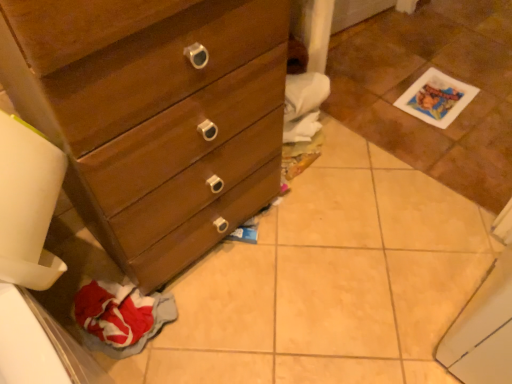
Locate an element on the screen. matte wood chest of drawers at lower left is located at coordinates (154, 115).

What do you see at coordinates (154, 115) in the screenshot? I see `matte wood chest of drawers at lower left` at bounding box center [154, 115].

The image size is (512, 384). Describe the element at coordinates (419, 76) in the screenshot. I see `white glossy tile at lower right` at that location.

What is the approximate width of white glossy tile at lower right?

white glossy tile at lower right is 78.42 centimeters in width.

Find the location of a particular element. Image resolution: width=512 pixels, height=384 pixels. white glossy tile at lower right is located at coordinates (419, 76).

This screenshot has width=512, height=384. I want to click on matte wood chest of drawers at lower left, so click(154, 115).

Is matte wood chest of drawers at lower left to the left of white glossy tile at lower right from the viewer's perspective?

Indeed, matte wood chest of drawers at lower left is positioned on the left side of white glossy tile at lower right.

Is matte wood chest of drawers at lower left in front of white glossy tile at lower right?

Yes, matte wood chest of drawers at lower left is closer to the viewer.

Considering the points (280, 44) and (357, 45), which point is behind, point (280, 44) or point (357, 45)?

Point (357, 45)

Looking at this image, from the image's perspective, would you say matte wood chest of drawers at lower left is shown under white glossy tile at lower right?

Indeed, from the image's perspective, matte wood chest of drawers at lower left is shown beneath white glossy tile at lower right.

From a real-world perspective, relative to white glossy tile at lower right, is matte wood chest of drawers at lower left vertically above or below?

In terms of real-world spatial position, matte wood chest of drawers at lower left is above white glossy tile at lower right.

Looking at their sizes, would you say matte wood chest of drawers at lower left is wider or thinner than white glossy tile at lower right?

matte wood chest of drawers at lower left is thinner than white glossy tile at lower right.

From their relative heights in the image, would you say matte wood chest of drawers at lower left is taller or shorter than white glossy tile at lower right?

Clearly, matte wood chest of drawers at lower left is taller compared to white glossy tile at lower right.

Between matte wood chest of drawers at lower left and white glossy tile at lower right, which one has larger size?

With larger size is matte wood chest of drawers at lower left.

Which is correct: matte wood chest of drawers at lower left is inside white glossy tile at lower right, or outside of it?

The correct answer is: outside.

Is there a large distance between matte wood chest of drawers at lower left and white glossy tile at lower right?

No, there isn't a large distance between matte wood chest of drawers at lower left and white glossy tile at lower right.

Does matte wood chest of drawers at lower left turn towards white glossy tile at lower right?

No.

How many degrees apart are the facing directions of matte wood chest of drawers at lower left and white glossy tile at lower right?

179 degrees separate the facing orientations of matte wood chest of drawers at lower left and white glossy tile at lower right.

Identify the location of tile on the right of matte wood chest of drawers at lower left. (419, 76).

Is white glossy tile at lower right to the right of matte wood chest of drawers at lower left from the viewer's perspective?

Yes.

Is white glossy tile at lower right positioned behind matte wood chest of drawers at lower left?

Yes, white glossy tile at lower right is further from the viewer.

Which is in front, point (492, 72) or point (136, 38)?

Point (136, 38)

From the image's perspective, which object appears higher, white glossy tile at lower right or matte wood chest of drawers at lower left?

white glossy tile at lower right is shown above in the image.

From a real-world perspective, which object stands above the other?

matte wood chest of drawers at lower left.

Which object is wider, white glossy tile at lower right or matte wood chest of drawers at lower left?

white glossy tile at lower right.

Is white glossy tile at lower right shorter than matte wood chest of drawers at lower left?

Correct, white glossy tile at lower right is not as tall as matte wood chest of drawers at lower left.

Can you confirm if white glossy tile at lower right is smaller than matte wood chest of drawers at lower left?

Yes.

Is matte wood chest of drawers at lower left surrounded by white glossy tile at lower right?

That's incorrect, matte wood chest of drawers at lower left is not inside white glossy tile at lower right.

Is white glossy tile at lower right placed right next to matte wood chest of drawers at lower left?

They are not placed beside each other.

Is white glossy tile at lower right facing towards matte wood chest of drawers at lower left?

No, white glossy tile at lower right is not facing towards matte wood chest of drawers at lower left.

How many degrees apart are the facing directions of white glossy tile at lower right and matte wood chest of drawers at lower left?

white glossy tile at lower right and matte wood chest of drawers at lower left are facing 179 degrees away from each other.

The width and height of the screenshot is (512, 384). I want to click on chest of drawers to the left of white glossy tile at lower right, so click(154, 115).

Locate an element on the screen. This screenshot has height=384, width=512. tile located on the right of matte wood chest of drawers at lower left is located at coordinates (419, 76).

The width and height of the screenshot is (512, 384). I want to click on chest of drawers that appears on the left of white glossy tile at lower right, so click(154, 115).